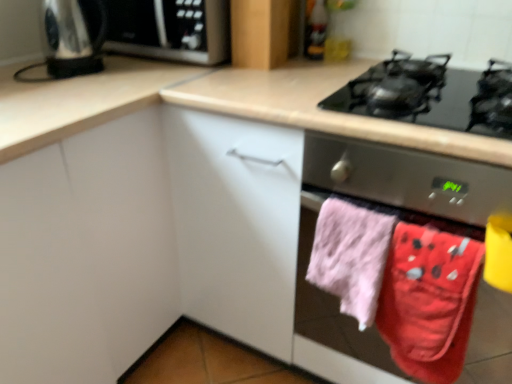
Question: From a real-world perspective, is shiny metallic kettle at upper left positioned under satin silver microwave at upper left based on gravity?

Choices:
 (A) no
 (B) yes

Answer: (A)

Question: From the image's perspective, is shiny metallic kettle at upper left on top of satin silver microwave at upper left?

Choices:
 (A) yes
 (B) no

Answer: (B)

Question: Is satin silver microwave at upper left inside shiny metallic kettle at upper left?

Choices:
 (A) no
 (B) yes

Answer: (A)

Question: Can we say shiny metallic kettle at upper left lies outside satin silver microwave at upper left?

Choices:
 (A) yes
 (B) no

Answer: (A)

Question: Does shiny metallic kettle at upper left come in front of satin silver microwave at upper left?

Choices:
 (A) no
 (B) yes

Answer: (B)

Question: Is shiny metallic kettle at upper left facing towards satin silver microwave at upper left?

Choices:
 (A) yes
 (B) no

Answer: (B)

Question: Does red cotton beach towel at lower right, acting as the second beach towel starting from the left, have a greater width compared to pink fluffy towel at lower right, marked as the first beach towel in a left-to-right arrangement?

Choices:
 (A) no
 (B) yes

Answer: (A)

Question: Can you confirm if red cotton beach towel at lower right, arranged as the 1th beach towel when viewed from the right, is bigger than pink fluffy towel at lower right, marked as the first beach towel in a left-to-right arrangement?

Choices:
 (A) no
 (B) yes

Answer: (A)

Question: From the image's perspective, is red cotton beach towel at lower right, acting as the second beach towel starting from the left, beneath pink fluffy towel at lower right, which is the 2th beach towel in right-to-left order?

Choices:
 (A) yes
 (B) no

Answer: (A)

Question: Is the depth of red cotton beach towel at lower right, arranged as the 1th beach towel when viewed from the right, less than that of pink fluffy towel at lower right, marked as the first beach towel in a left-to-right arrangement?

Choices:
 (A) no
 (B) yes

Answer: (B)

Question: Considering the relative positions of red cotton beach towel at lower right, acting as the second beach towel starting from the left, and pink fluffy towel at lower right, marked as the first beach towel in a left-to-right arrangement, in the image provided, is red cotton beach towel at lower right, acting as the second beach towel starting from the left, to the left of pink fluffy towel at lower right, marked as the first beach towel in a left-to-right arrangement, from the viewer's perspective?

Choices:
 (A) no
 (B) yes

Answer: (A)

Question: Does red cotton beach towel at lower right, acting as the second beach towel starting from the left, appear on the right side of pink fluffy towel at lower right, which is the 2th beach towel in right-to-left order?

Choices:
 (A) no
 (B) yes

Answer: (B)

Question: Does white matte cabinet at center, positioned as the second cabinetry in back-to-front order, appear on the left side of red cotton beach towel at lower right, acting as the second beach towel starting from the left?

Choices:
 (A) yes
 (B) no

Answer: (A)